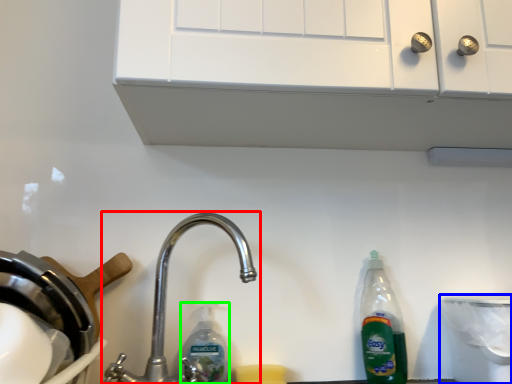
Question: Considering the real-world distances, which object is farthest from tap (highlighted by a red box)? appliance (highlighted by a blue box) or cleaning product (highlighted by a green box)?

Choices:
 (A) appliance
 (B) cleaning product

Answer: (A)